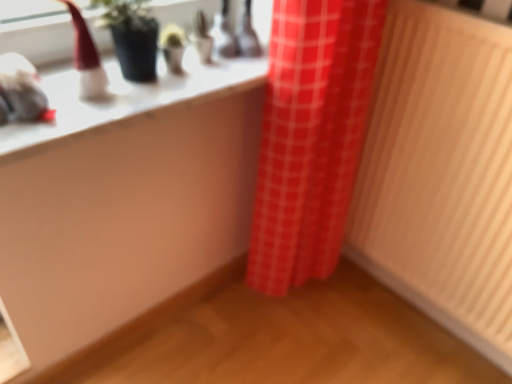
Question: From the image's perspective, is wooden radiator at right located above or below red checkered curtain at center?

Choices:
 (A) above
 (B) below

Answer: (B)

Question: Considering the positions of wooden radiator at right and red checkered curtain at center in the image, is wooden radiator at right taller or shorter than red checkered curtain at center?

Choices:
 (A) short
 (B) tall

Answer: (B)

Question: Which object is positioned closest to the red checkered curtain at center?

Choices:
 (A) white glossy counter top at upper left
 (B) wooden radiator at right

Answer: (B)

Question: Which of these objects is positioned closest to the white glossy counter top at upper left?

Choices:
 (A) wooden radiator at right
 (B) red checkered curtain at center

Answer: (B)